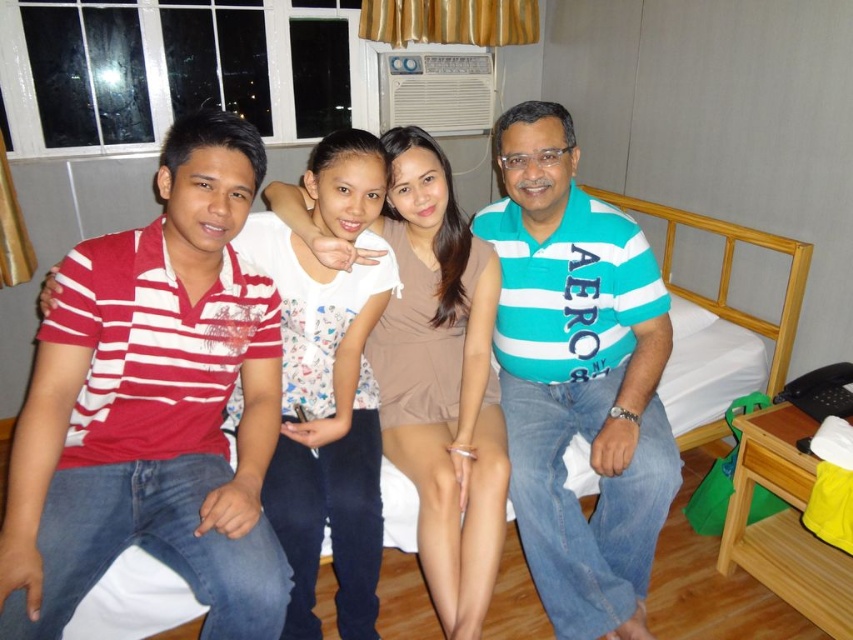
Question: Where is teal striped polo shirt at center located in relation to white fabric bed at center in the image?

Choices:
 (A) right
 (B) left

Answer: (B)

Question: Among these points, which one is farthest from the camera?

Choices:
 (A) [x=506, y=326]
 (B) [x=712, y=278]

Answer: (B)

Question: Does teal striped polo shirt at center have a larger size compared to white fabric bed at center?

Choices:
 (A) no
 (B) yes

Answer: (A)

Question: Which point is farther to the camera?

Choices:
 (A) 735,362
 (B) 550,132

Answer: (A)

Question: Is teal striped polo shirt at center above white fabric bed at center?

Choices:
 (A) yes
 (B) no

Answer: (B)